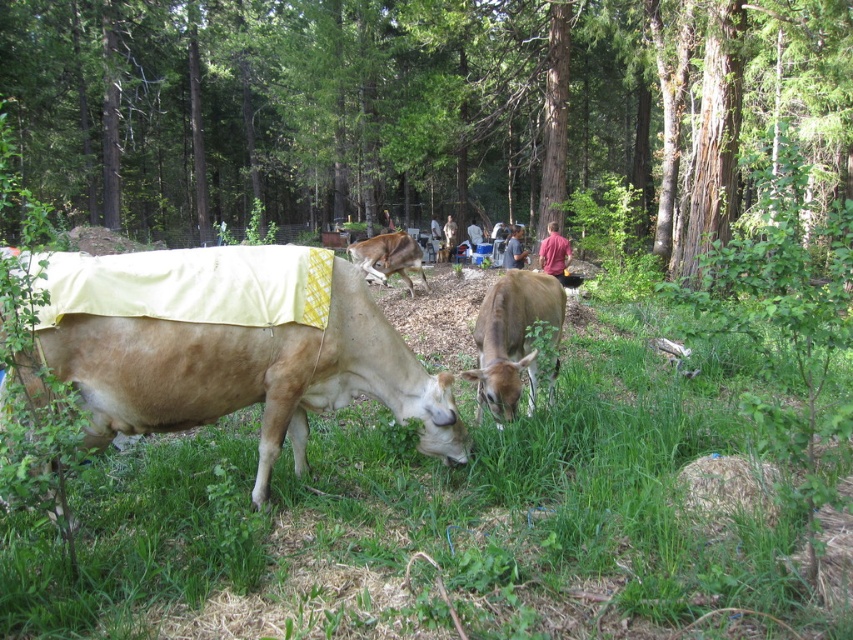
You are standing in the forest and want to reach the two points marked in the image. Which point, point (67,573) or point (370,340), is closer to you?

Point (67,573) is closer to you than point (370,340).